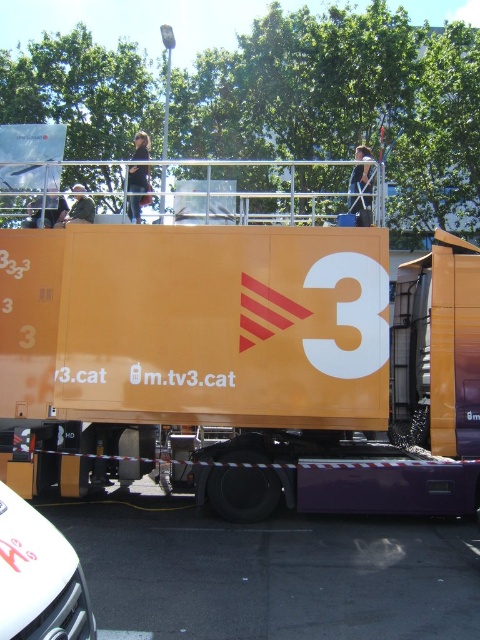
Based on the photo, you are a pedestrian standing at the intersection and see the orange matte truck at center and the white glossy car at lower left. Which vehicle is closer to you?

The orange matte truck at center is closer to you because the white glossy car at lower left is behind it.

In the scene shown: You are standing 2 meters away from the orange matte truck at center. You want to take a photo of it from a distance of 5 meters. Can you move backward to achieve this?

The orange matte truck at center is 6.25 meters from camera. Since you are currently 2 meters away from the orange matte truck at center, moving backward would increase your distance from it. To take the photo from 5 meters away, you need to be 5 meters from the truck. Since it is already 6.25 meters away, you are already beyond the desired distance. Therefore, you don not need to move further back. You can take the photo from your current position.

You are driving a delivery van that is 2.5 meters wide and want to park it between the orange matte truck at center and the white glossy car at lower left. Is there enough space between them to park your van?

The orange matte truck at center is 3.79 meters from the white glossy car at lower left. Since your van is 2.5 meters wide, there is sufficient space to park between them as 3.79 meters is greater than 2.5 meters.